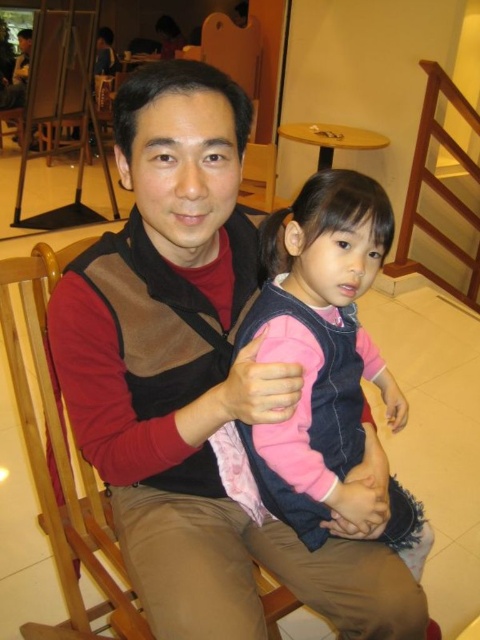
You are a tailor measuring the distance between two vests in a photo. The brown suede vest at center and the pink fleece vest at center are both visible. Can you fit a 5 inch wide measuring tape between them without overlapping either vest?

The brown suede vest at center and pink fleece vest at center are 4.93 inches apart from each other. Since 4.93 inches is less than 5 inches, the measuring tape cannot fit between them without overlapping either vest.

You are a photographer adjusting your camera to focus on the brown suede vest at center and the pink fleece vest at center. Which vest should you focus on first to ensure both are in sharp focus?

You should focus on the brown suede vest at center first because it is closer to the viewer than the pink fleece vest at center, so adjusting focus starting from the closer object ensures both will be in sharp focus.

You are a photographer adjusting your camera to focus on two points in the image. The first point is labeled as point [358,470] and the second is point [282,512]. Which point is closer to the camera?

Point [358,470] is further to the viewer than point [282,512], so the point closer to the camera is point [282,512].